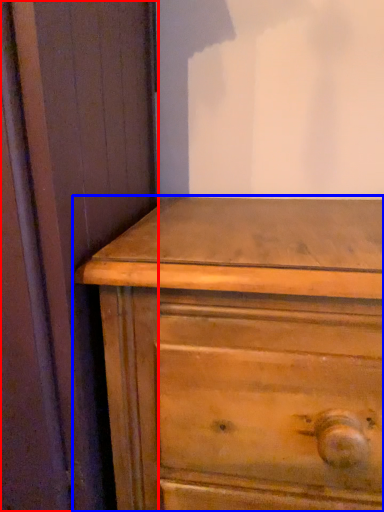
Question: Which of the following is the farthest to the observer, screen door (highlighted by a red box) or chest of drawers (highlighted by a blue box)?

Choices:
 (A) screen door
 (B) chest of drawers

Answer: (B)